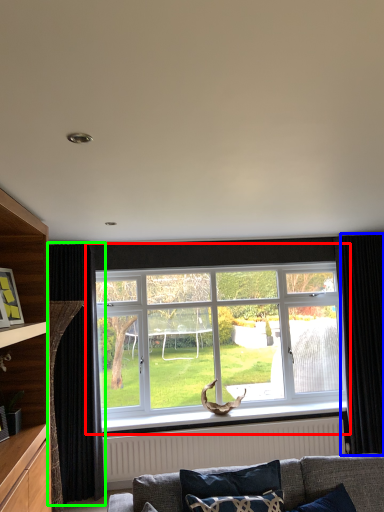
Question: Considering the real-world distances, which object is closest to window (highlighted by a red box)? curtain (highlighted by a blue box) or curtain (highlighted by a green box).

Choices:
 (A) curtain
 (B) curtain

Answer: (A)